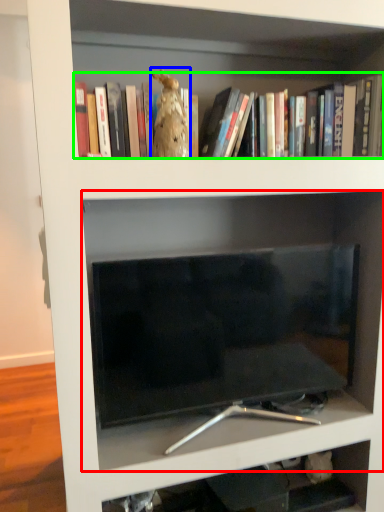
Question: Which object is positioned farthest from shelf (highlighted by a red box)? Select from animal (highlighted by a blue box) and book (highlighted by a green box).

Choices:
 (A) animal
 (B) book

Answer: (A)